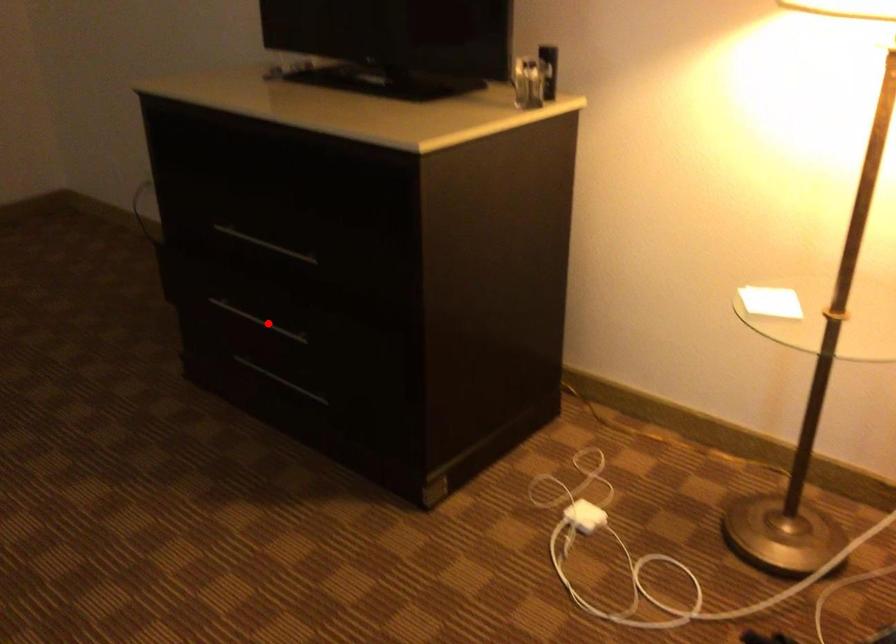
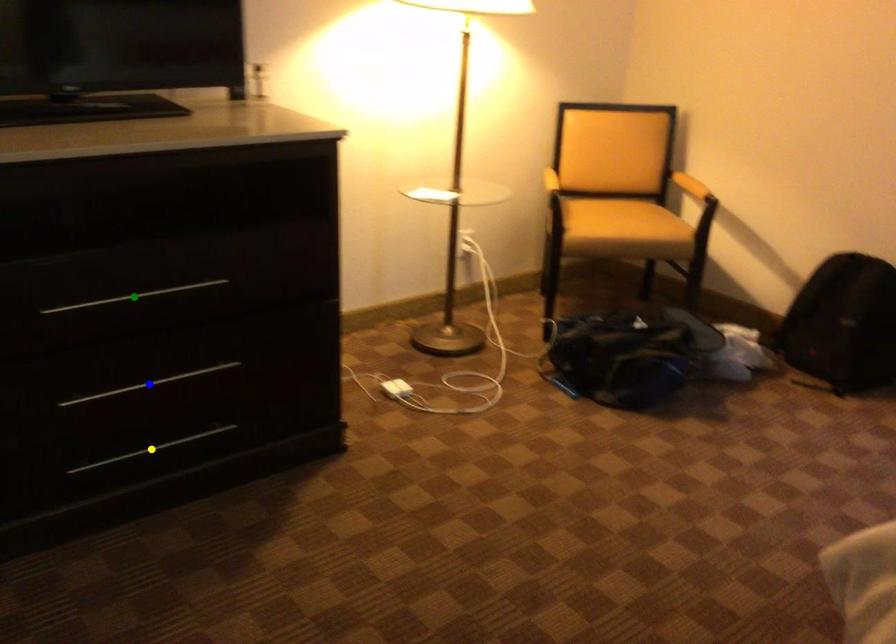
Question: I am providing you with two images of the same scene from different viewpoints. A red point is marked on the first image. You are given multiple points on the second image. Which spot in image 2 lines up with the point in image 1?

Choices:
 (A) yellow point
 (B) blue point
 (C) green point

Answer: (B)